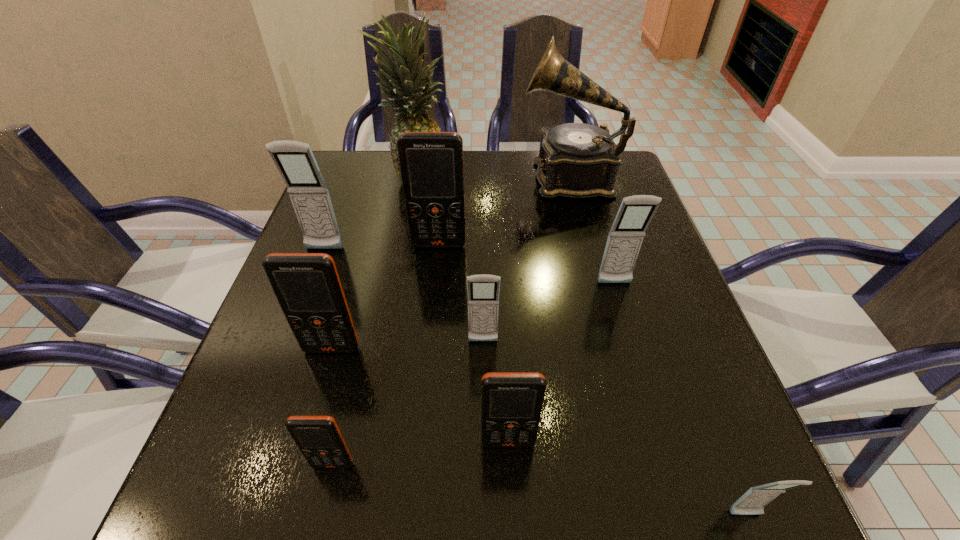
The width and height of the screenshot is (960, 540). In order to click on free space located 0.100m on the horn of the ninth shortest object in this screenshot , I will do `click(483, 177)`.

Where is `vacant region located 0.140m on the screen of the farthest orange cellular telephone`? This screenshot has width=960, height=540. vacant region located 0.140m on the screen of the farthest orange cellular telephone is located at coordinates (434, 297).

Image resolution: width=960 pixels, height=540 pixels. What are the coordinates of `free point located on the front-facing side of the farthest gray cellular telephone` in the screenshot? It's located at (264, 411).

At what (x,y) coordinates should I click in order to perform the action: click on vacant space located on the front-facing side of the second gray cellular telephone from right to left. Please return your answer as a coordinate pair (x, y). The height and width of the screenshot is (540, 960). Looking at the image, I should click on (677, 492).

Where is `vacant space located on the screen of the third nearest orange cellular telephone`? Image resolution: width=960 pixels, height=540 pixels. vacant space located on the screen of the third nearest orange cellular telephone is located at coordinates (320, 390).

At what (x,y) coordinates should I click in order to perform the action: click on blank space located 0.150m on the front-facing side of the second smallest gray cellular telephone. Please return your answer as a coordinate pair (x, y). The image size is (960, 540). Looking at the image, I should click on click(484, 427).

Find the location of a particular element. pineapple present at the far edge is located at coordinates (409, 88).

This screenshot has width=960, height=540. Identify the location of phonograph record situated at the far edge. (576, 160).

Locate an element on the screen. This screenshot has width=960, height=540. pineapple at the left edge is located at coordinates (409, 88).

Where is `phonograph record that is at the right edge`? The image size is (960, 540). phonograph record that is at the right edge is located at coordinates (576, 160).